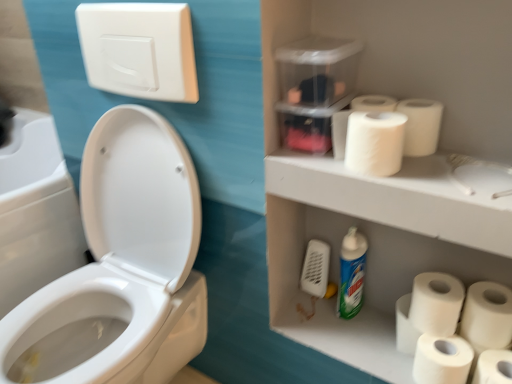
Locate an element on the screen. This screenshot has height=384, width=512. free point to the left of white glossy cleaning product at lower center is located at coordinates (302, 305).